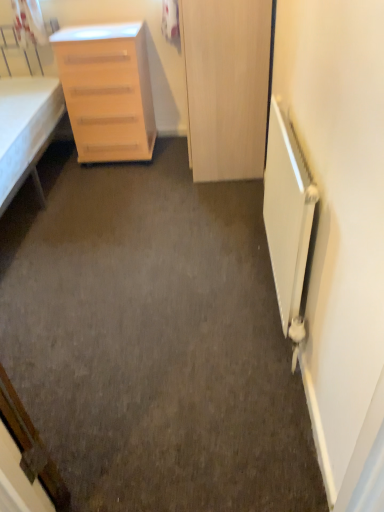
At what (x,y) coordinates should I click in order to perform the action: click on vacant area that is in front of light wood/finely finished chest of drawers at left. Please return your answer as a coordinate pair (x, y). The height and width of the screenshot is (512, 384). Looking at the image, I should click on (111, 185).